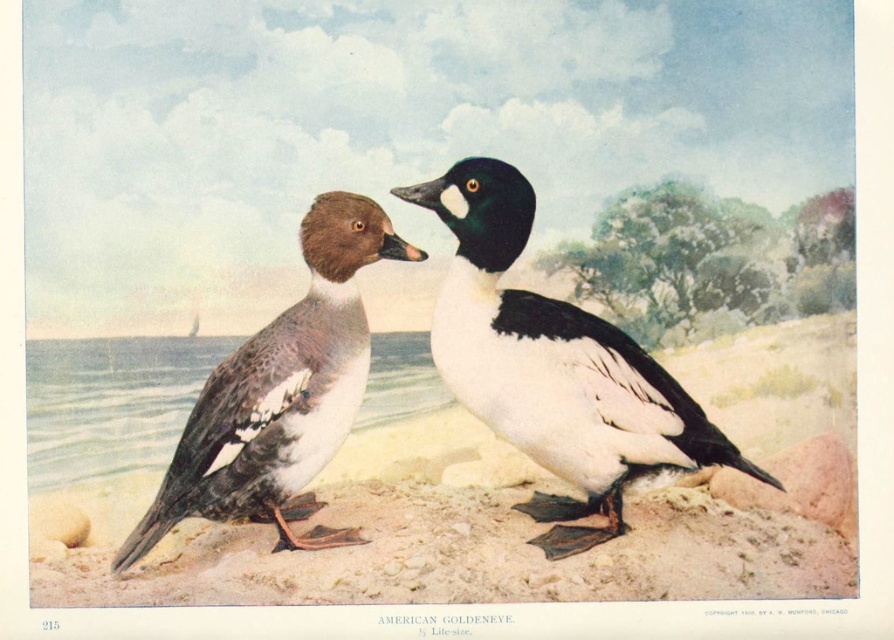
Does smooth sand at lower center appear on the left side of white matte duck at center?

Yes, smooth sand at lower center is to the left of white matte duck at center.

Is smooth sand at lower center positioned behind white matte duck at center?

No, smooth sand at lower center is in front of white matte duck at center.

Between point (656, 502) and point (664, 385), which one is positioned behind?

The point (656, 502) is more distant.

What are the coordinates of `smooth sand at lower center` in the screenshot? It's located at (473, 556).

Between smooth sand at lower center and brown speckled feathers at center, which one has more height?

brown speckled feathers at center

Which is more to the right, smooth sand at lower center or brown speckled feathers at center?

smooth sand at lower center

Between point (586, 580) and point (389, 228), which one is positioned in front?

Positioned in front is point (586, 580).

The height and width of the screenshot is (640, 894). I want to click on smooth sand at lower center, so click(473, 556).

Which is more to the right, smooth sand at lower center or smooth gray water at lower left?

Positioned to the right is smooth sand at lower center.

Is smooth sand at lower center bigger than smooth gray water at lower left?

Correct, smooth sand at lower center is larger in size than smooth gray water at lower left.

You are a GUI agent. You are given a task and a screenshot of the screen. Output one action in this format:
    pyautogui.click(x=<x>, y=<y>)
    Task: Click on the smooth sand at lower center
    
    Given the screenshot: What is the action you would take?
    pyautogui.click(x=473, y=556)

Identify the location of smooth sand at lower center. (473, 556).